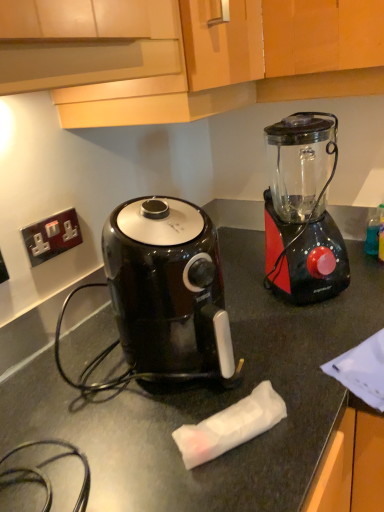
The image size is (384, 512). Describe the element at coordinates (52, 236) in the screenshot. I see `metallic socket at upper left` at that location.

Describe the element at coordinates (190, 55) in the screenshot. I see `wooden cabinet at upper center` at that location.

Measure the distance between point (193, 290) and camera.

The distance of point (193, 290) from camera is 66.00 centimeters.

Where is `metallic socket at upper left`? metallic socket at upper left is located at coordinates (52, 236).

Would you consider wooden cabinet at upper center to be distant from black plastic blender at right?

No, wooden cabinet at upper center is in close proximity to black plastic blender at right.

Is wooden cabinet at upper center shorter than black plastic blender at right?

Correct, wooden cabinet at upper center is not as tall as black plastic blender at right.

Is wooden cabinet at upper center oriented towards black plastic blender at right?

No.

Locate an element on the screen. The width and height of the screenshot is (384, 512). blender directly beneath the wooden cabinet at upper center (from a real-world perspective) is located at coordinates (303, 209).

Find the location of a particular element. coffee maker behind the wooden cabinet at upper center is located at coordinates (168, 290).

Is wooden cabinet at upper center not near black glossy air fryer at center?

No.

Does wooden cabinet at upper center turn towards black glossy air fryer at center?

No, wooden cabinet at upper center is not oriented towards black glossy air fryer at center.

Does wooden cabinet at upper center touch metallic socket at upper left?

There is a gap between wooden cabinet at upper center and metallic socket at upper left.

In the scene shown: Is wooden cabinet at upper center positioned beyond the bounds of metallic socket at upper left?

Yes, wooden cabinet at upper center is not within metallic socket at upper left.

Does wooden cabinet at upper center have a lesser height compared to metallic socket at upper left?

In fact, wooden cabinet at upper center may be taller than metallic socket at upper left.

Is point (25, 51) farther from viewer compared to point (51, 220)?

No, it is not.

Is there a large distance between black glossy air fryer at center and metallic socket at upper left?

black glossy air fryer at center is near metallic socket at upper left, not far away.

Would you say black glossy air fryer at center is to the left or to the right of metallic socket at upper left in the picture?

In the image, black glossy air fryer at center appears on the right side of metallic socket at upper left.

Who is shorter, black glossy air fryer at center or metallic socket at upper left?

Standing shorter between the two is metallic socket at upper left.

Is black glossy air fryer at center bigger or smaller than metallic socket at upper left?

Considering their sizes, black glossy air fryer at center takes up more space than metallic socket at upper left.

Consider the image. Based on their sizes in the image, would you say black plastic blender at right is bigger or smaller than black glossy air fryer at center?

black plastic blender at right is bigger than black glossy air fryer at center.

Is black plastic blender at right aimed at black glossy air fryer at center?

No, black plastic blender at right does not turn towards black glossy air fryer at center.

Which is behind, black plastic blender at right or black glossy air fryer at center?

black plastic blender at right is behind.

From the picture: Is black plastic blender at right positioned far away from black glossy air fryer at center?

black plastic blender at right is near black glossy air fryer at center, not far away.

From the picture: Can we say black plastic blender at right lies outside metallic socket at upper left?

black plastic blender at right is positioned outside metallic socket at upper left.

From a real-world perspective, is black plastic blender at right on top of metallic socket at upper left?

No, from a real-world perspective, black plastic blender at right is not above metallic socket at upper left.

Which point is more forward, [305,229] or [75,213]?

Positioned in front is point [305,229].

Does point (307, 164) come farther from viewer compared to point (142, 9)?

Yes.

Looking at this image, would you consider black plastic blender at right to be distant from wooden cabinet at upper center?

No, black plastic blender at right is in close proximity to wooden cabinet at upper center.

From the image's perspective, is black plastic blender at right located beneath wooden cabinet at upper center?

Yes, from the image's perspective, black plastic blender at right is beneath wooden cabinet at upper center.

Looking at this image, is black plastic blender at right at the right side of wooden cabinet at upper center?

Yes.

Where is `cabinetry that is on the left side of black plastic blender at right`? Image resolution: width=384 pixels, height=512 pixels. cabinetry that is on the left side of black plastic blender at right is located at coordinates (190, 55).

Where is `cabinetry above the black glossy air fryer at center (from the image's perspective)`? cabinetry above the black glossy air fryer at center (from the image's perspective) is located at coordinates (190, 55).

Which object lies further to the anchor point black plastic blender at right, metallic socket at upper left or wooden cabinet at upper center?

Among the two, metallic socket at upper left is located further to black plastic blender at right.

Which object lies further to the anchor point wooden cabinet at upper center, black glossy air fryer at center or metallic socket at upper left?

Among the two, metallic socket at upper left is located further to wooden cabinet at upper center.

Looking at this image, based on their spatial positions, is black plastic blender at right or black glossy air fryer at center further from metallic socket at upper left?

black plastic blender at right.

Based on the photo, from the image, which object appears to be farther from black plastic blender at right, wooden cabinet at upper center or black glossy air fryer at center?

black glossy air fryer at center lies further to black plastic blender at right than the other object.

Based on the photo, considering their positions, is black glossy air fryer at center positioned further to wooden cabinet at upper center than black plastic blender at right?

black glossy air fryer at center is positioned further to the anchor wooden cabinet at upper center.

From the image, which object appears to be farther from black glossy air fryer at center, black plastic blender at right or metallic socket at upper left?

The object further to black glossy air fryer at center is black plastic blender at right.

Looking at the image, which one is located closer to metallic socket at upper left, wooden cabinet at upper center or black plastic blender at right?

wooden cabinet at upper center lies closer to metallic socket at upper left than the other object.

Based on their spatial positions, is black plastic blender at right or wooden cabinet at upper center closer to metallic socket at upper left?

wooden cabinet at upper center is closer to metallic socket at upper left.

This screenshot has height=512, width=384. Find the location of `coffee maker between metallic socket at upper left and black plastic blender at right`. coffee maker between metallic socket at upper left and black plastic blender at right is located at coordinates (168, 290).

Locate an element on the screen. The image size is (384, 512). cabinetry located between metallic socket at upper left and black plastic blender at right in the left-right direction is located at coordinates (190, 55).

I want to click on power outlet between wooden cabinet at upper center and black glossy air fryer at center from top to bottom, so click(x=52, y=236).

At what (x,y) coordinates should I click in order to perform the action: click on blender between wooden cabinet at upper center and black glossy air fryer at center in the vertical direction. Please return your answer as a coordinate pair (x, y). Image resolution: width=384 pixels, height=512 pixels. Looking at the image, I should click on (303, 209).